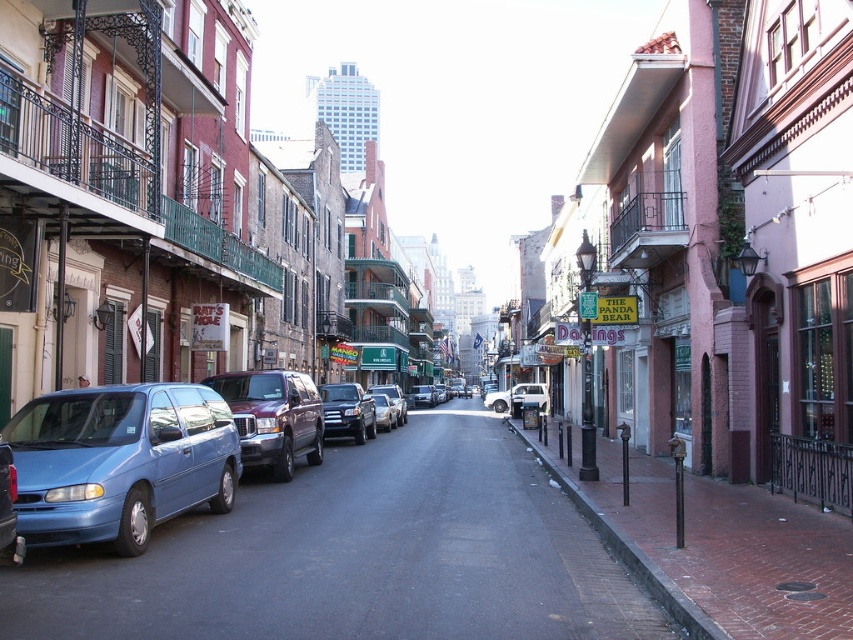
Between satin black suv at center and metallic silver sedan at center, which one appears on the right side from the viewer's perspective?

metallic silver sedan at center is more to the right.

Does point (323, 392) lie in front of point (425, 392)?

Yes, point (323, 392) is closer to viewer.

Where is `satin black suv at center`? The width and height of the screenshot is (853, 640). satin black suv at center is located at coordinates (347, 412).

Where is `satin black suv at center`? The image size is (853, 640). satin black suv at center is located at coordinates point(347,412).

Based on the photo, does matte blue van at lower left come behind metallic silver sedan at center?

No, it is in front of metallic silver sedan at center.

In the scene shown: Between matte blue van at lower left and metallic silver sedan at center, which one appears on the left side from the viewer's perspective?

matte blue van at lower left

At what (x,y) coordinates should I click in order to perform the action: click on matte blue van at lower left. Please return your answer as a coordinate pair (x, y). This screenshot has width=853, height=640. Looking at the image, I should click on (120, 461).

Does point (688, 541) come behind point (436, 401)?

No, it is not.

Find the location of `brass metal fire hydrant at lower right`. brass metal fire hydrant at lower right is located at coordinates (718, 548).